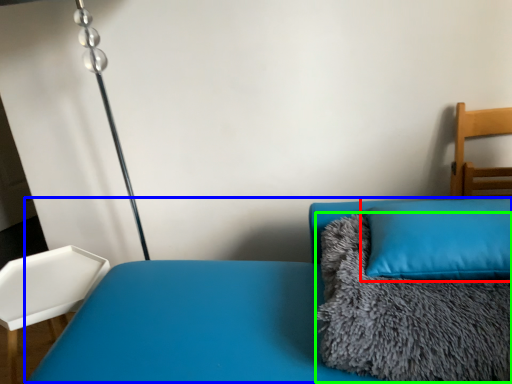
Question: Which object is the closest to the pillow (highlighted by a red box)? Choose among these: couch (highlighted by a blue box) or blanket (highlighted by a green box).

Choices:
 (A) couch
 (B) blanket

Answer: (B)